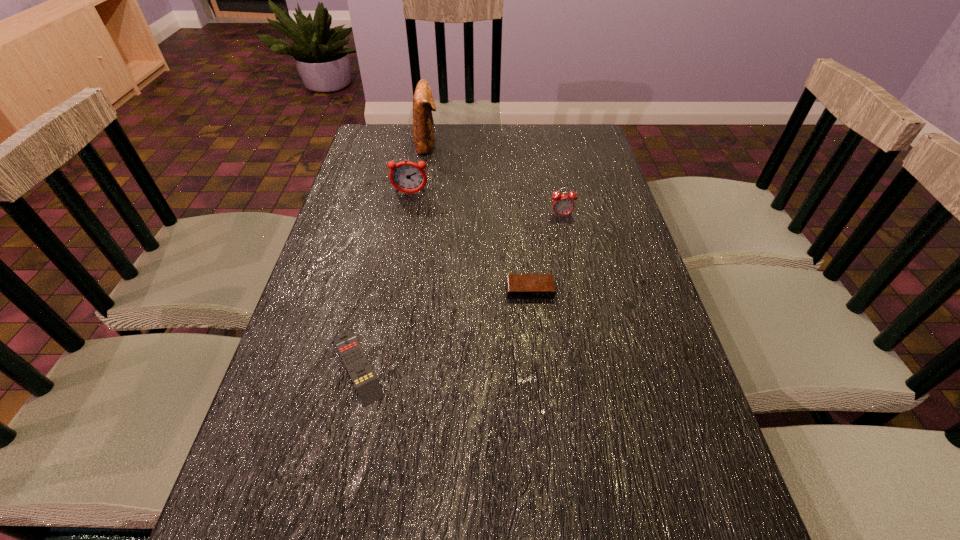
Locate an element on the screen. The width and height of the screenshot is (960, 540). blank region between the third nearest object and the nearest alarm clock is located at coordinates (546, 253).

Select which object appears as the closest to the tallest alarm clock. Please provide its 2D coordinates. Your answer should be formatted as a tuple, i.e. [(x, y)], where the tuple contains the x and y coordinates of a point satisfying the conditions above.

[(423, 102)]

Where is `object that stands as the third closest to the second tallest alarm clock`? The width and height of the screenshot is (960, 540). object that stands as the third closest to the second tallest alarm clock is located at coordinates (423, 102).

Identify which alarm clock is the second closest to the tallest alarm clock. Please provide its 2D coordinates. Your answer should be formatted as a tuple, i.e. [(x, y)], where the tuple contains the x and y coordinates of a point satisfying the conditions above.

[(519, 286)]

Select which alarm clock is the second closest to the nearest alarm clock. Please provide its 2D coordinates. Your answer should be formatted as a tuple, i.e. [(x, y)], where the tuple contains the x and y coordinates of a point satisfying the conditions above.

[(408, 177)]